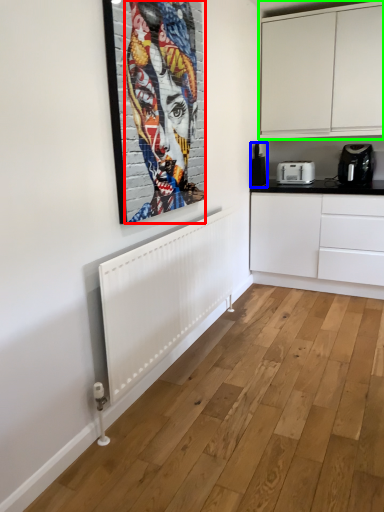
Question: Which object is the farthest from person (highlighted by a red box)? Choose among these: coffee machine (highlighted by a blue box) or cabinetry (highlighted by a green box).

Choices:
 (A) coffee machine
 (B) cabinetry

Answer: (B)